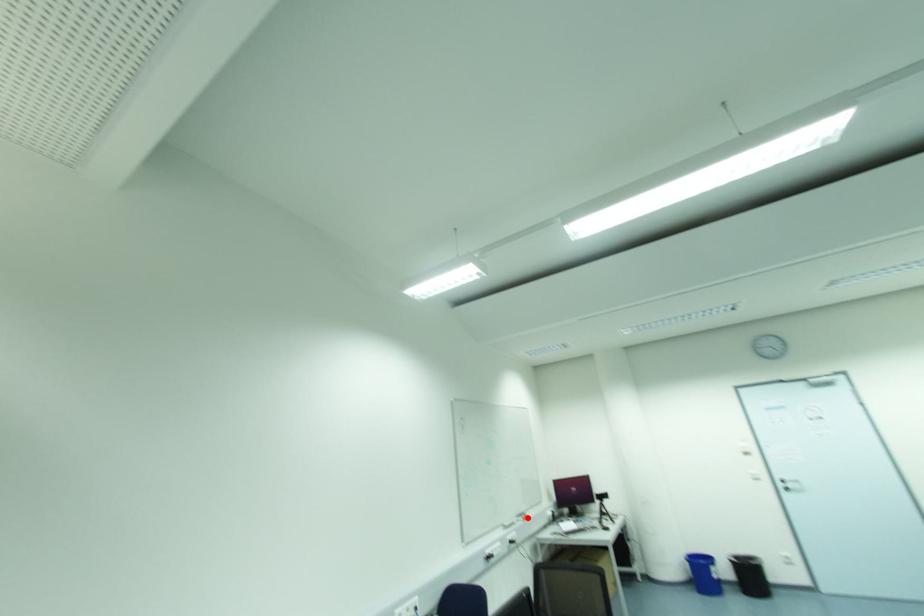
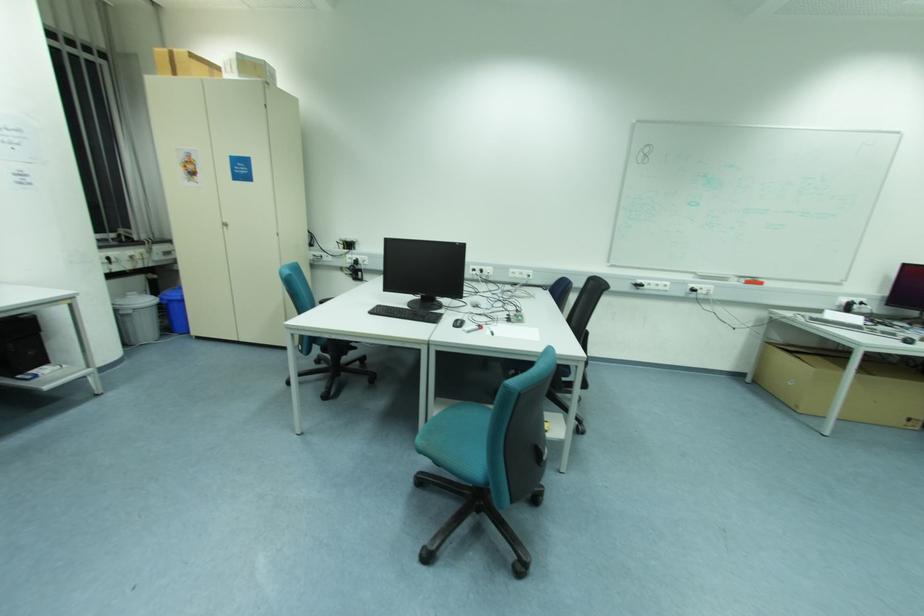
In the second image, find the point that corresponds to the highlighted location in the first image.

(761, 284)